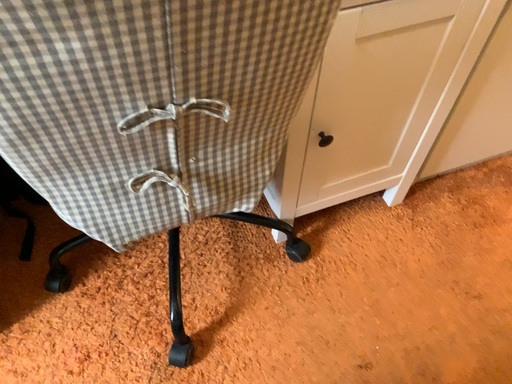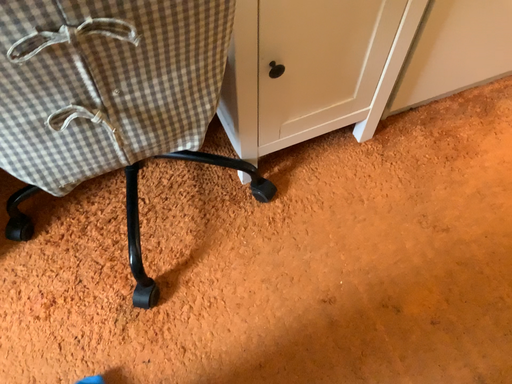
Question: Which way did the camera rotate in the video?

Choices:
 (A) rotated downward
 (B) rotated upward

Answer: (A)